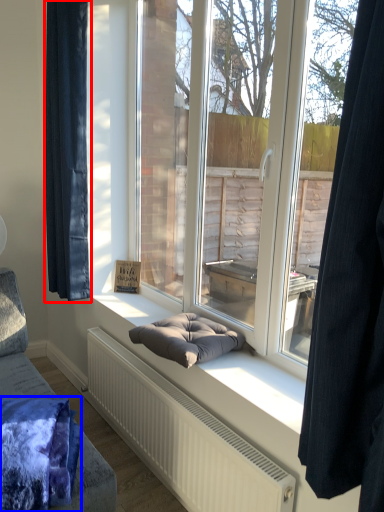
Question: Which of the following is the farthest to the observer, curtain (highlighted by a red box) or blanket (highlighted by a blue box)?

Choices:
 (A) curtain
 (B) blanket

Answer: (A)